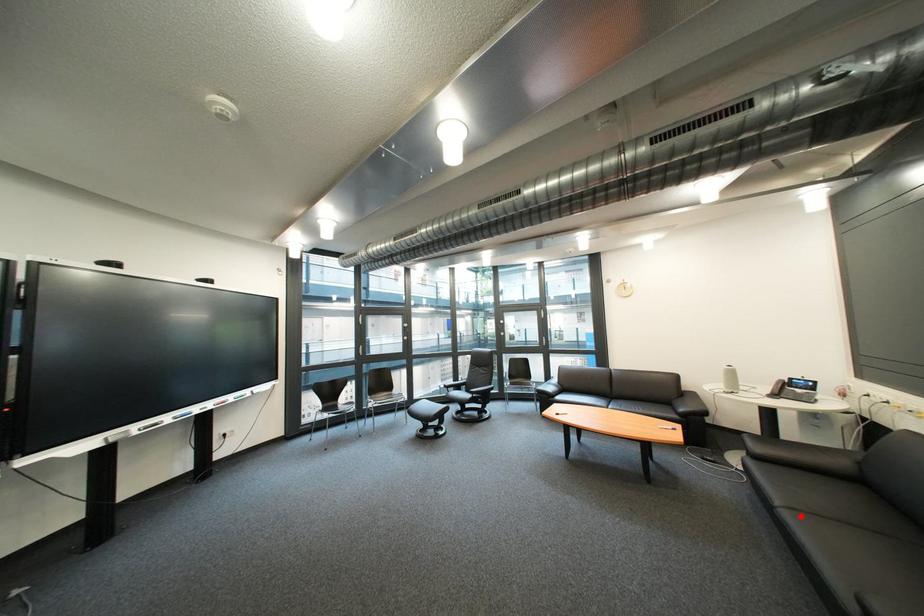
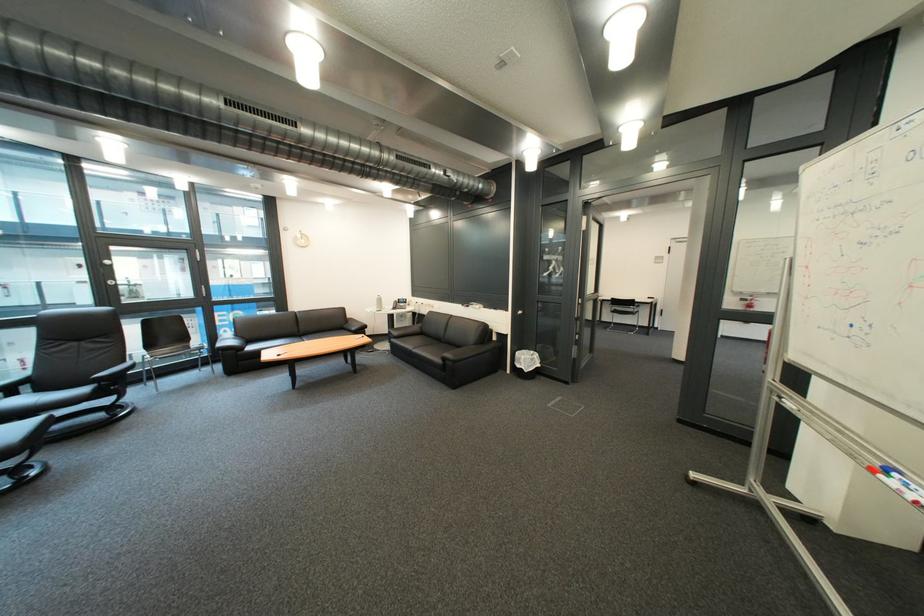
Where in the second image is the point corresponding to the highlighted location from the first image?

(429, 353)